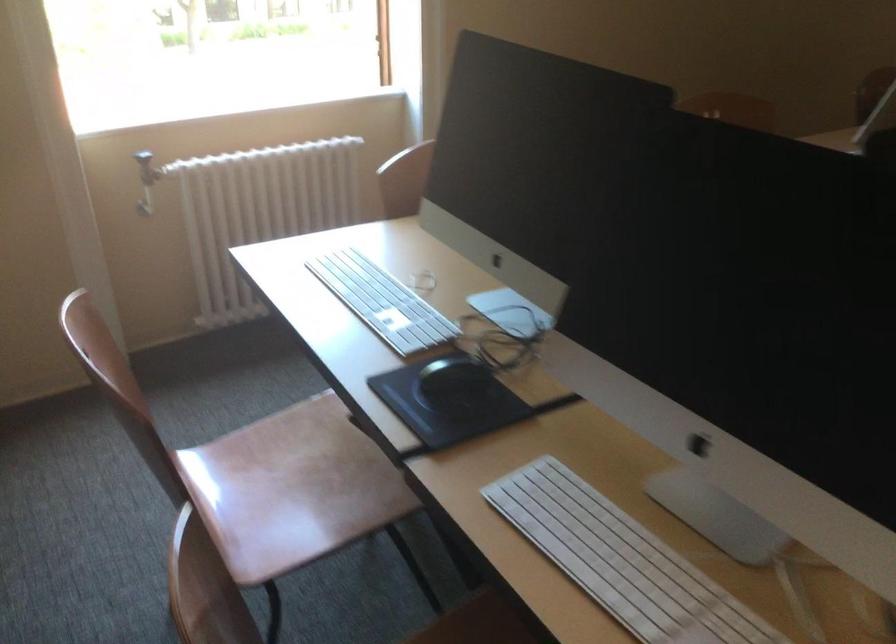
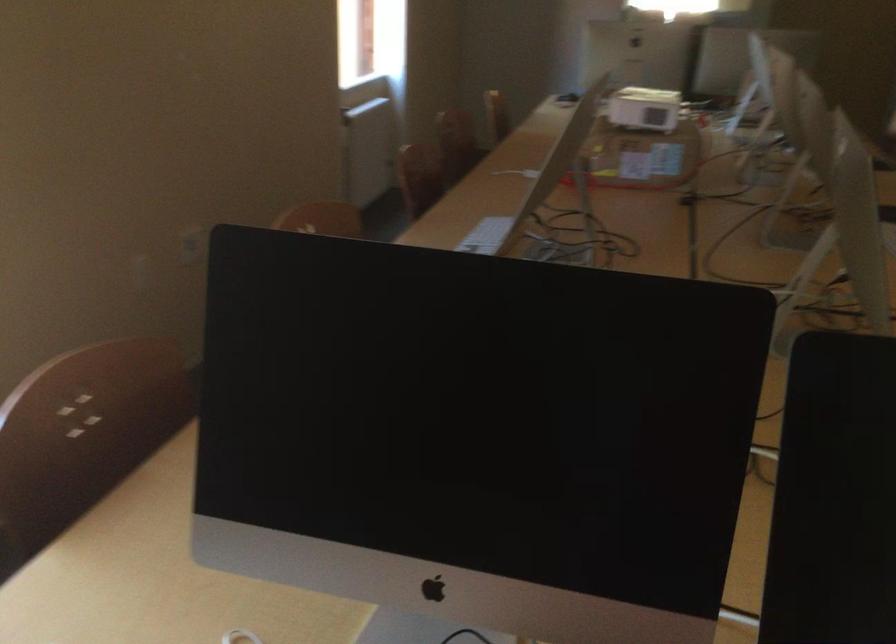
Question: How did the camera likely rotate?

Choices:
 (A) Left
 (B) Right
 (C) Up
 (D) Down

Answer: (B)